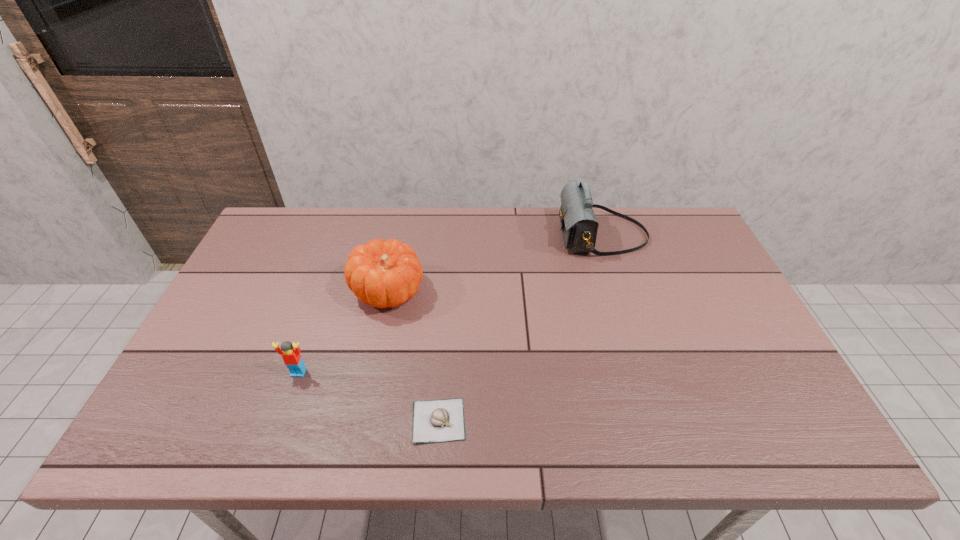
Find the location of a particular element. The height and width of the screenshot is (540, 960). vacant area situated on the face of the second nearest object is located at coordinates (279, 428).

You are a GUI agent. You are given a task and a screenshot of the screen. Output one action in this format:
    pyautogui.click(x=<x>, y=<y>)
    Task: Click on the free space located 0.070m on the left of the garlic
    The image size is (960, 540).
    Given the screenshot: What is the action you would take?
    pyautogui.click(x=379, y=420)

I want to click on object at the far edge, so click(579, 226).

At what (x,y) coordinates should I click in order to perform the action: click on object at the near edge. Please return your answer as a coordinate pair (x, y). The height and width of the screenshot is (540, 960). Looking at the image, I should click on tap(442, 420).

Where is `free space at the far edge`? Image resolution: width=960 pixels, height=540 pixels. free space at the far edge is located at coordinates (350, 214).

I want to click on vacant area at the near edge, so click(x=572, y=426).

The height and width of the screenshot is (540, 960). What are the coordinates of `vacant space at the left edge of the desktop` in the screenshot? It's located at (288, 262).

This screenshot has height=540, width=960. In order to click on free space at the right edge in this screenshot , I will do `click(797, 410)`.

Find the location of a particular element. Image resolution: width=960 pixels, height=540 pixels. vacant space at the far right corner of the desktop is located at coordinates (663, 216).

The height and width of the screenshot is (540, 960). What are the coordinates of `vacant point located between the tallest object and the pumpkin` in the screenshot? It's located at (495, 263).